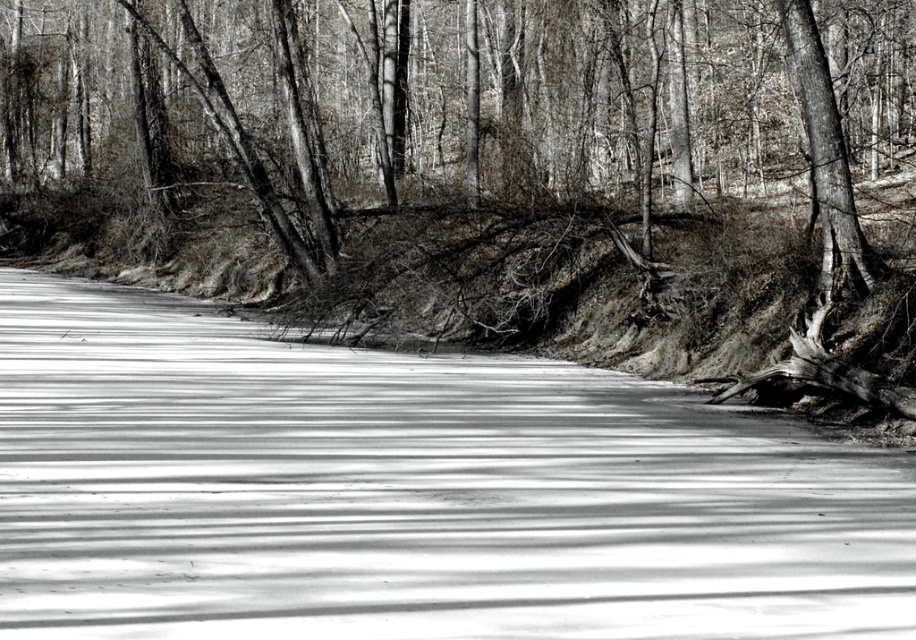
In the black and white photograph, you see a smooth bark tree at center and a smooth ice at center. Which object takes up more space in the image?

The smooth bark tree at center is bigger than the smooth ice at center, so it takes up more space in the image.

You are standing at the point marked by coordinates point (492,172) in the image. Looking around, you notice a smooth bark tree at center. What is the immediate environment around you like?

The point (492,172) indicates a smooth bark tree at center, so you are standing at the base of this tree. The immediate environment includes the frozen body of water in the foreground and the steep, sloping bank with bare trees and shrubs in the midground.